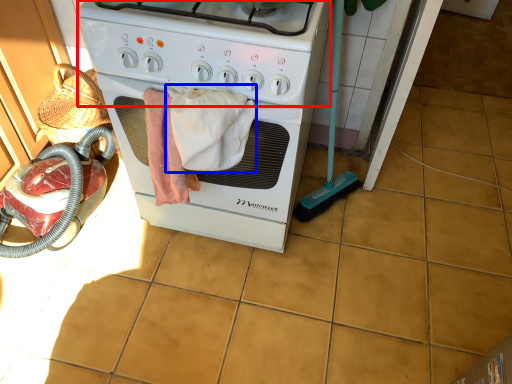
Question: Which point is closer to the camera, gas stove (highlighted by a red box) or bath towel (highlighted by a blue box)?

Choices:
 (A) gas stove
 (B) bath towel

Answer: (A)